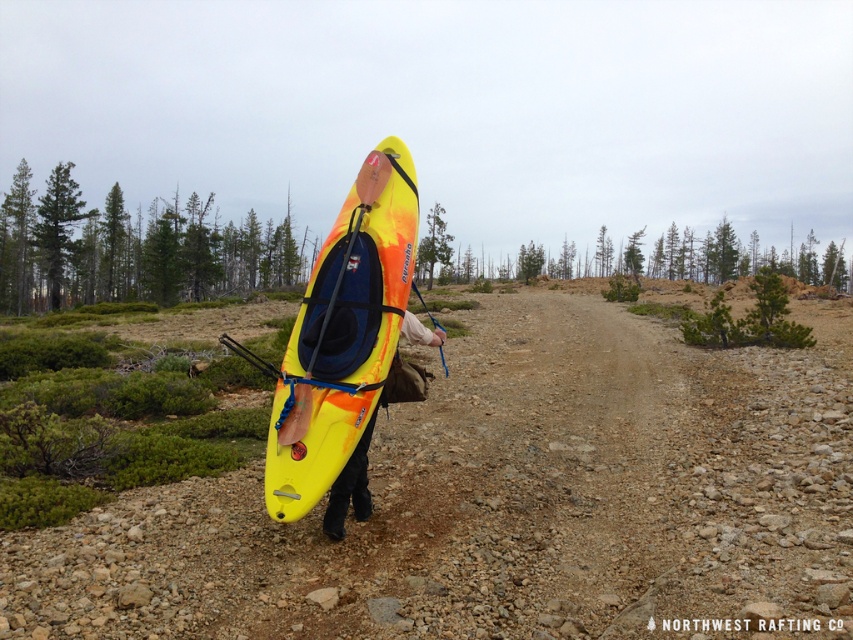
Consider the image. Who is shorter, dirtgravelly/granulartrack at center or yellow matte kayak at center?

With less height is dirtgravelly/granulartrack at center.

What do you see at coordinates (506, 502) in the screenshot?
I see `dirtgravelly/granulartrack at center` at bounding box center [506, 502].

Identify the location of dirtgravelly/granulartrack at center. (506, 502).

Is yellow matte kayak at center closer to the viewer compared to yellow plastic kayak at center?

Yes, yellow matte kayak at center is in front of yellow plastic kayak at center.

Does point (328, 364) come farther from viewer compared to point (418, 333)?

No, (328, 364) is in front of (418, 333).

Find the location of a particular element. The height and width of the screenshot is (640, 853). yellow matte kayak at center is located at coordinates (343, 333).

Can you confirm if dirtgravelly/granulartrack at center is positioned above yellow plastic kayak at center?

Correct, dirtgravelly/granulartrack at center is located above yellow plastic kayak at center.

Which is above, dirtgravelly/granulartrack at center or yellow plastic kayak at center?

dirtgravelly/granulartrack at center is above.

I want to click on dirtgravelly/granulartrack at center, so click(x=506, y=502).

At what (x,y) coordinates should I click in order to perform the action: click on dirtgravelly/granulartrack at center. Please return your answer as a coordinate pair (x, y). The height and width of the screenshot is (640, 853). Looking at the image, I should click on (506, 502).